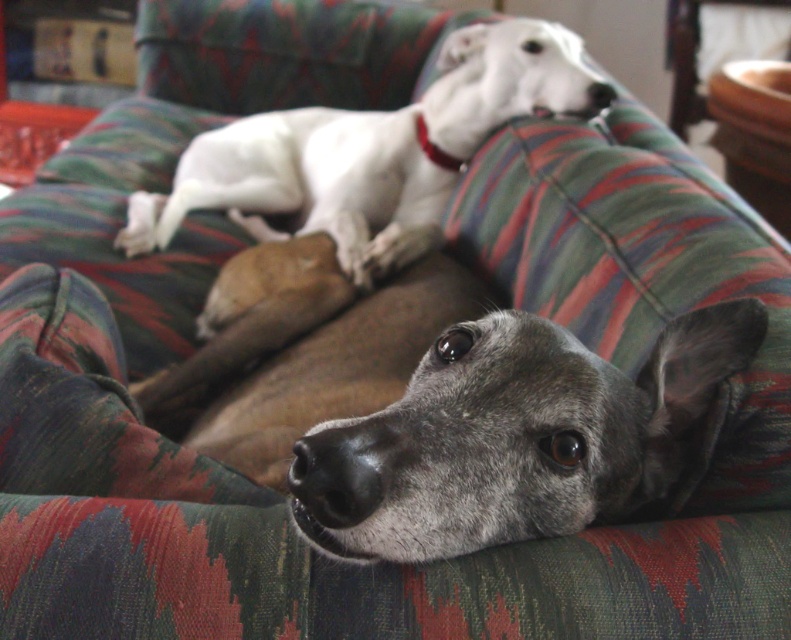
Is gray fur dog at center to the left of white smooth dog at upper center from the viewer's perspective?

In fact, gray fur dog at center is to the right of white smooth dog at upper center.

Does gray fur dog at center appear over white smooth dog at upper center?

No, gray fur dog at center is not above white smooth dog at upper center.

The height and width of the screenshot is (640, 791). What are the coordinates of `gray fur dog at center` in the screenshot? It's located at (513, 436).

Find the location of `gray fur dog at center`. gray fur dog at center is located at coordinates (513, 436).

Can you confirm if white smooth dog at upper center is positioned below red leather neckband at center?

Yes.

Does point (441, 65) lie behind point (419, 128)?

Yes, it is behind point (419, 128).

Where is `white smooth dog at upper center`? white smooth dog at upper center is located at coordinates (373, 150).

Which of these two, gray fur dog at center or red leather neckband at center, stands taller?

With more height is gray fur dog at center.

Between gray fur dog at center and red leather neckband at center, which one is positioned higher?

red leather neckband at center is above.

Image resolution: width=791 pixels, height=640 pixels. I want to click on gray fur dog at center, so pyautogui.click(x=513, y=436).

Identify the location of gray fur dog at center. This screenshot has height=640, width=791. (513, 436).